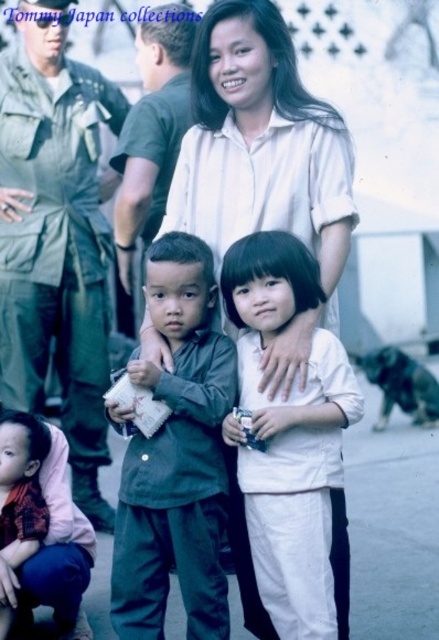
You are a photographer trying to position a spotlight at the exact center of the image. Given the coordinates provided for the white matte shirt at center, where should you place the spotlight relative to this object?

The white matte shirt at center is located at coordinates point [291,422]. To place the spotlight at the exact center of the image, you should position it at point [219,320], which is slightly to the left and above the white matte shirt at center.

You are standing in front of the woman at center. You want to touch the point at coordinate point (263, 163). Which object should you reach for?

The point at coordinate point (263, 163) is on white cotton shirt at center, so you should reach for the white cotton shirt at center.